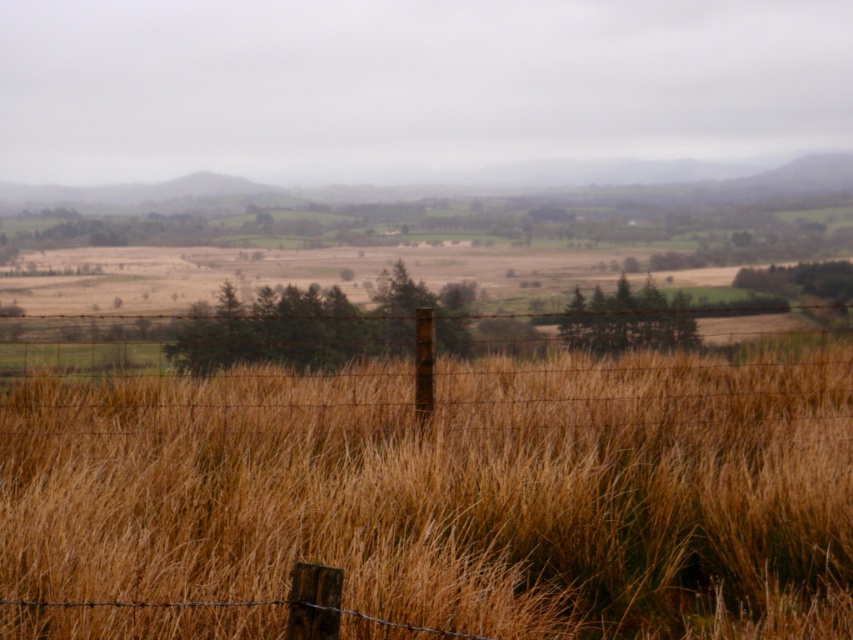
Question: Does brown dry grass at center appear over barbed wire fence at center?

Choices:
 (A) no
 (B) yes

Answer: (A)

Question: Can you confirm if brown dry grass at center is wider than barbed wire fence at center?

Choices:
 (A) no
 (B) yes

Answer: (B)

Question: Is brown dry grass at center wider than barbed wire fence at center?

Choices:
 (A) yes
 (B) no

Answer: (A)

Question: Which object is closer to the camera taking this photo?

Choices:
 (A) brown dry grass at center
 (B) barbed wire fence at center

Answer: (A)

Question: Which point is farther from the camera taking this photo?

Choices:
 (A) (521, 348)
 (B) (555, 406)

Answer: (A)